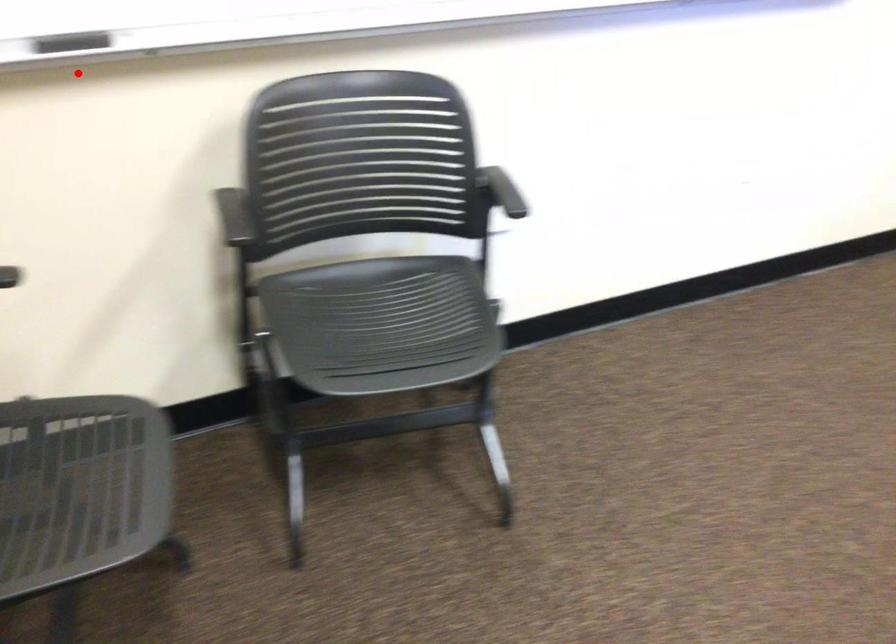
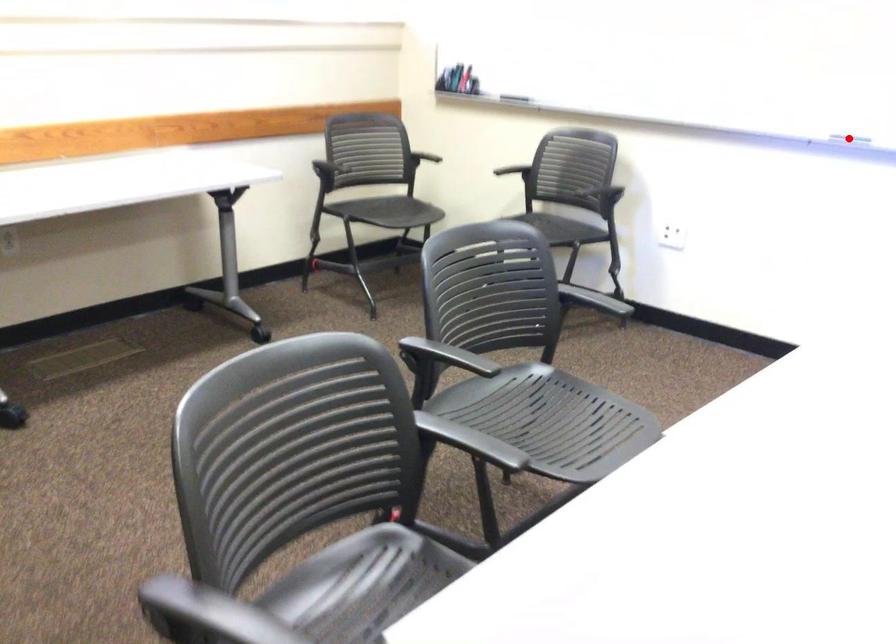
I am providing you with two images of the same scene from different viewpoints. A red point is marked on the first image and another point is marked on the second image. Are the points marked in image1 and image2 representing the same 3D position?

No